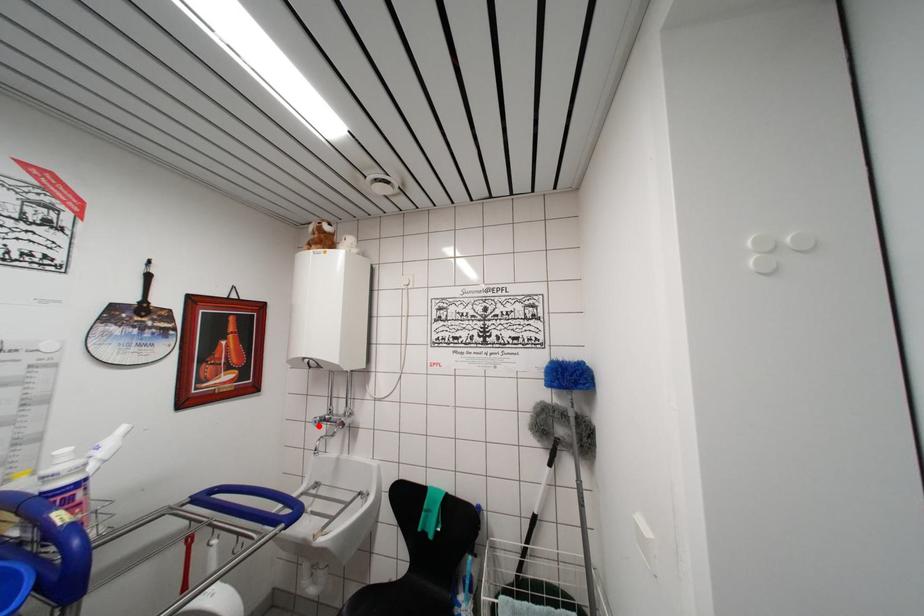
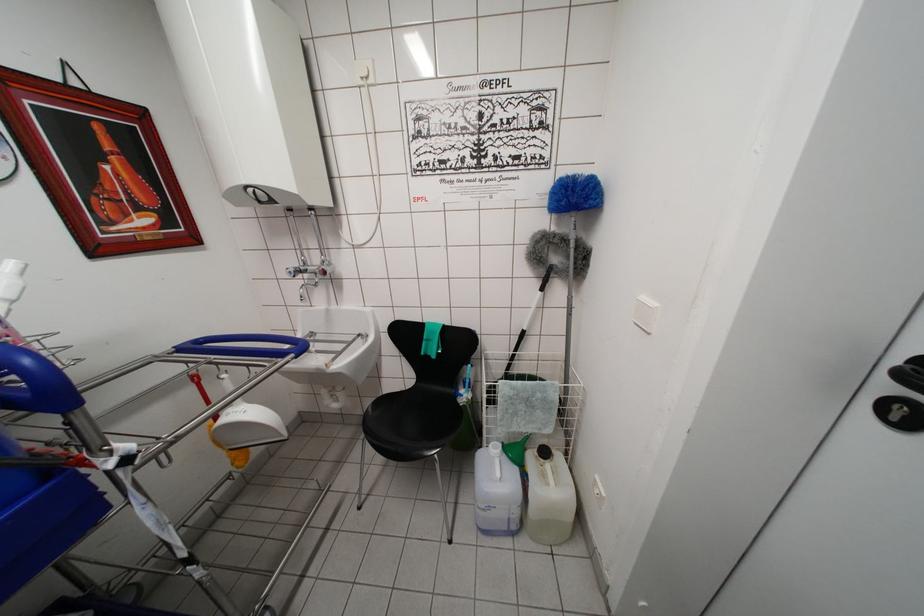
Where in the second image is the point corresponding to the highlighted location from the first image?

(293, 277)